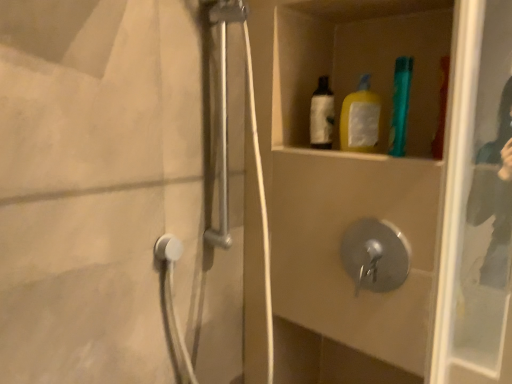
This screenshot has height=384, width=512. What are the coordinates of `metallic silver shower door at left` in the screenshot? It's located at (227, 154).

The height and width of the screenshot is (384, 512). What do you see at coordinates (400, 105) in the screenshot? I see `teal plastic toothbrush at upper right` at bounding box center [400, 105].

Describe the element at coordinates (114, 192) in the screenshot. I see `transparent glass screen door at upper right` at that location.

Identify the location of metallic silver shower door at left. (227, 154).

How different are the orientations of transparent glass screen door at upper right and teal plastic toothbrush at upper right in degrees?

transparent glass screen door at upper right and teal plastic toothbrush at upper right are facing 91.7 degrees away from each other.

The height and width of the screenshot is (384, 512). Find the location of `bottle that appears on the right of transparent glass screen door at upper right`. bottle that appears on the right of transparent glass screen door at upper right is located at coordinates (400, 105).

In the image, is transparent glass screen door at upper right on the left side or the right side of teal plastic toothbrush at upper right?

From the image, it's evident that transparent glass screen door at upper right is to the left of teal plastic toothbrush at upper right.

Is transparent glass screen door at upper right in front of teal plastic toothbrush at upper right?

Yes, it is.

Is point (180, 363) more distant than point (399, 84)?

Yes, point (180, 363) is behind point (399, 84).

Would you say metallic silver shower door at left is a long distance from teal plastic toothbrush at upper right?

Actually, metallic silver shower door at left and teal plastic toothbrush at upper right are a little close together.

From the image's perspective, which one is positioned lower, metallic silver shower door at left or teal plastic toothbrush at upper right?

From the image's view, metallic silver shower door at left is below.

From a real-world perspective, which is physically above, metallic silver shower door at left or teal plastic toothbrush at upper right?

In real-world perspective, teal plastic toothbrush at upper right is above.

Can you confirm if teal plastic toothbrush at upper right is positioned to the right of metallic silver shower door at left?

Correct, you'll find teal plastic toothbrush at upper right to the right of metallic silver shower door at left.

Is metallic silver shower door at left located within teal plastic toothbrush at upper right?

No, teal plastic toothbrush at upper right does not contain metallic silver shower door at left.

What's the angular difference between teal plastic toothbrush at upper right and metallic silver shower door at left's facing directions?

They differ by 93.4 degrees in their facing directions.

Find the location of a particular element. screen door below the metallic silver shower door at left (from the image's perspective) is located at coordinates (114, 192).

In terms of height, does transparent glass screen door at upper right look taller or shorter compared to metallic silver shower door at left?

In the image, transparent glass screen door at upper right appears to be shorter than metallic silver shower door at left.

Which is in front, transparent glass screen door at upper right or metallic silver shower door at left?

Positioned in front is transparent glass screen door at upper right.

From a real-world perspective, is teal plastic toothbrush at upper right above or below transparent glass screen door at upper right?

teal plastic toothbrush at upper right is above transparent glass screen door at upper right.

Where is `screen door located in front of the teal plastic toothbrush at upper right`? This screenshot has width=512, height=384. screen door located in front of the teal plastic toothbrush at upper right is located at coordinates (114, 192).

Are teal plastic toothbrush at upper right and transparent glass screen door at upper right located far from each other?

No, teal plastic toothbrush at upper right is not far from transparent glass screen door at upper right.

Is teal plastic toothbrush at upper right closer to the viewer compared to transparent glass screen door at upper right?

No, teal plastic toothbrush at upper right is further to the viewer.

Is metallic silver shower door at left bigger than transparent glass screen door at upper right?

Incorrect, metallic silver shower door at left is not larger than transparent glass screen door at upper right.

Considering the relative positions of metallic silver shower door at left and transparent glass screen door at upper right in the image provided, is metallic silver shower door at left to the left or to the right of transparent glass screen door at upper right?

In the image, metallic silver shower door at left appears on the left side of transparent glass screen door at upper right.

Would you consider metallic silver shower door at left to be distant from transparent glass screen door at upper right?

That's not correct — metallic silver shower door at left is a little close to transparent glass screen door at upper right.

Is metallic silver shower door at left taller or shorter than transparent glass screen door at upper right?

metallic silver shower door at left is taller than transparent glass screen door at upper right.

Where is `bottle behind the transparent glass screen door at upper right`? bottle behind the transparent glass screen door at upper right is located at coordinates (400, 105).

At what (x,y) coordinates should I click in order to perform the action: click on bottle located above the metallic silver shower door at left (from the image's perspective). Please return your answer as a coordinate pair (x, y). Image resolution: width=512 pixels, height=384 pixels. Looking at the image, I should click on (400, 105).

Based on their spatial positions, is teal plastic toothbrush at upper right or metallic silver shower door at left closer to transparent glass screen door at upper right?

metallic silver shower door at left is positioned closer to the anchor transparent glass screen door at upper right.

From the image, which object appears to be nearer to metallic silver shower door at left, transparent glass screen door at upper right or teal plastic toothbrush at upper right?

Based on the image, transparent glass screen door at upper right appears to be nearer to metallic silver shower door at left.

Looking at the image, which one is located closer to metallic silver shower door at left, teal plastic toothbrush at upper right or transparent glass screen door at upper right?

Among the two, transparent glass screen door at upper right is located nearer to metallic silver shower door at left.

Which object lies further to the anchor point teal plastic toothbrush at upper right, metallic silver shower door at left or transparent glass screen door at upper right?

transparent glass screen door at upper right is further to teal plastic toothbrush at upper right.

Considering their positions, is transparent glass screen door at upper right positioned further to teal plastic toothbrush at upper right than metallic silver shower door at left?

transparent glass screen door at upper right is further to teal plastic toothbrush at upper right.

Considering their positions, is metallic silver shower door at left positioned further to transparent glass screen door at upper right than teal plastic toothbrush at upper right?

Based on the image, teal plastic toothbrush at upper right appears to be further to transparent glass screen door at upper right.

Where is `shower door located between transparent glass screen door at upper right and teal plastic toothbrush at upper right in the depth direction`? shower door located between transparent glass screen door at upper right and teal plastic toothbrush at upper right in the depth direction is located at coordinates [x=227, y=154].